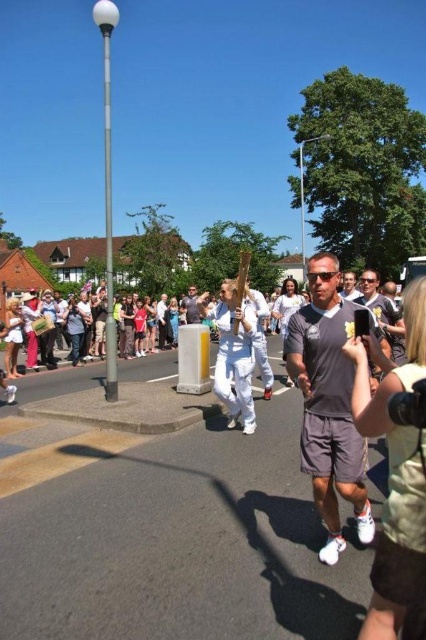
Question: Can you confirm if gray matte shorts at center is positioned to the left of white cotton shirt at center?

Choices:
 (A) no
 (B) yes

Answer: (A)

Question: Based on their relative distances, which object is nearer to the gray matte shorts at center?

Choices:
 (A) white cotton shirt at center
 (B) matte gray t-shirt at center

Answer: (B)

Question: Among these objects, which one is nearest to the camera?

Choices:
 (A) matte gray t-shirt at center
 (B) white cotton shirt at center
 (C) gray matte shorts at center

Answer: (C)

Question: Which object appears closest to the camera in this image?

Choices:
 (A) gray matte shorts at center
 (B) matte gray t-shirt at center

Answer: (A)

Question: In this image, where is gray matte shorts at center located relative to matte gray t-shirt at center?

Choices:
 (A) right
 (B) left

Answer: (B)

Question: Considering the relative positions of white cotton shirt at center and matte gray t-shirt at center in the image provided, where is white cotton shirt at center located with respect to matte gray t-shirt at center?

Choices:
 (A) below
 (B) above

Answer: (B)